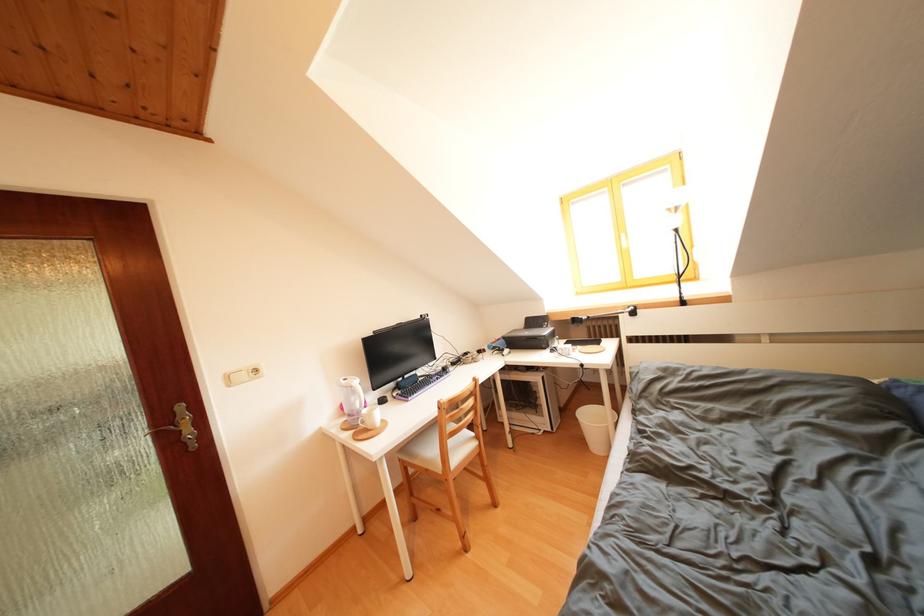
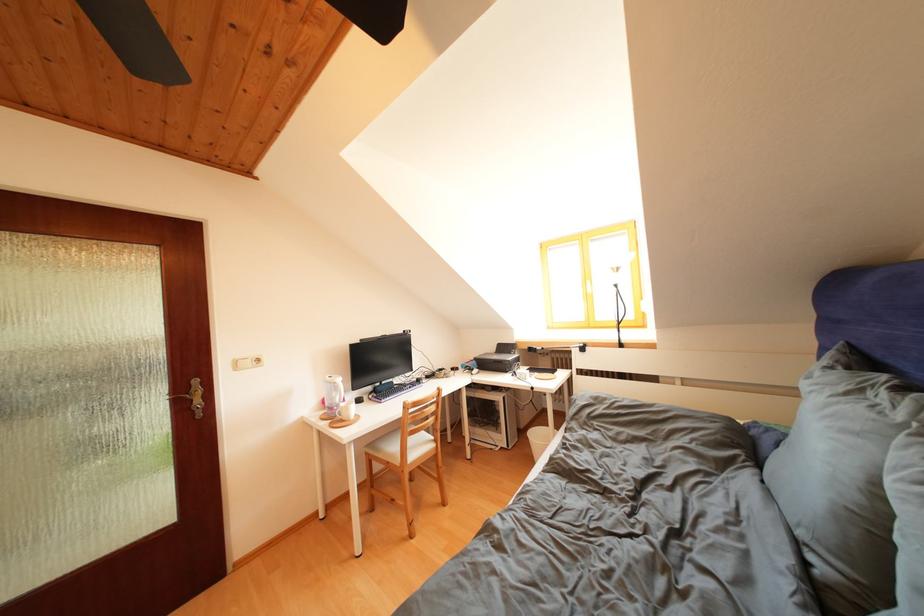
Where in the second image is the point corresponding to point (458, 448) from the first image?

(419, 446)